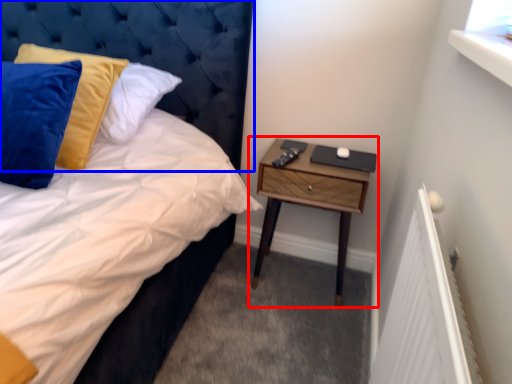
Question: Which object appears closest to the camera in this image, nightstand (highlighted by a red box) or headboard (highlighted by a blue box)?

Choices:
 (A) nightstand
 (B) headboard

Answer: (B)